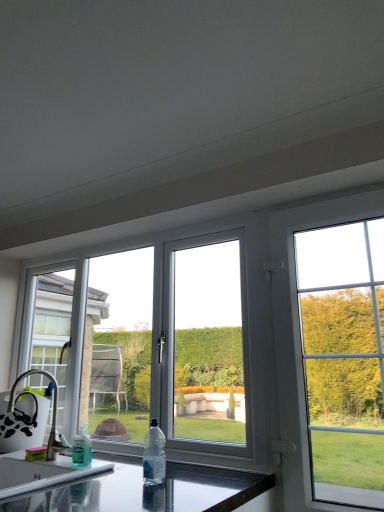
Question: Is the depth of black glossy countertop at lower center greater than that of white plastic window at upper right, the 1th window from the right?

Choices:
 (A) yes
 (B) no

Answer: (B)

Question: Considering the relative sizes of black glossy countertop at lower center and white plastic window at upper right, which appears as the second window when viewed from the left, in the image provided, is black glossy countertop at lower center thinner than white plastic window at upper right, which appears as the second window when viewed from the left,?

Choices:
 (A) yes
 (B) no

Answer: (B)

Question: Does black glossy countertop at lower center lie in front of white plastic window at upper right, the 1th window from the right?

Choices:
 (A) no
 (B) yes

Answer: (B)

Question: Would you say white plastic window at upper right, the 1th window from the right, is part of black glossy countertop at lower center's contents?

Choices:
 (A) yes
 (B) no

Answer: (B)

Question: Is black glossy countertop at lower center taller than white plastic window at upper right, which appears as the second window when viewed from the left?

Choices:
 (A) no
 (B) yes

Answer: (A)

Question: Can you see black glossy countertop at lower center touching white plastic window at upper right, which appears as the second window when viewed from the left?

Choices:
 (A) yes
 (B) no

Answer: (B)

Question: Is black glossy countertop at lower center located outside silver metallic faucet at lower left?

Choices:
 (A) no
 (B) yes

Answer: (B)

Question: Can you confirm if black glossy countertop at lower center is bigger than silver metallic faucet at lower left?

Choices:
 (A) yes
 (B) no

Answer: (A)

Question: Could silver metallic faucet at lower left be considered to be inside black glossy countertop at lower center?

Choices:
 (A) yes
 (B) no

Answer: (B)

Question: Is black glossy countertop at lower center in contact with silver metallic faucet at lower left?

Choices:
 (A) yes
 (B) no

Answer: (B)

Question: Is black glossy countertop at lower center smaller than silver metallic faucet at lower left?

Choices:
 (A) no
 (B) yes

Answer: (A)

Question: Is black glossy countertop at lower center not close to silver metallic faucet at lower left?

Choices:
 (A) yes
 (B) no

Answer: (B)

Question: Is clear plastic bottle at center, arranged as the second bottle when viewed from the left, placed right next to clear plastic bottle at lower left, positioned as the 1th bottle in left-to-right order?

Choices:
 (A) no
 (B) yes

Answer: (A)